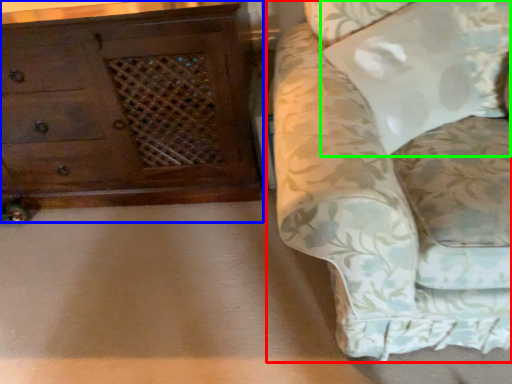
Question: Which object is positioned farthest from studio couch (highlighted by a red box)? Select from chest of drawers (highlighted by a blue box) and pillow (highlighted by a green box).

Choices:
 (A) chest of drawers
 (B) pillow

Answer: (A)